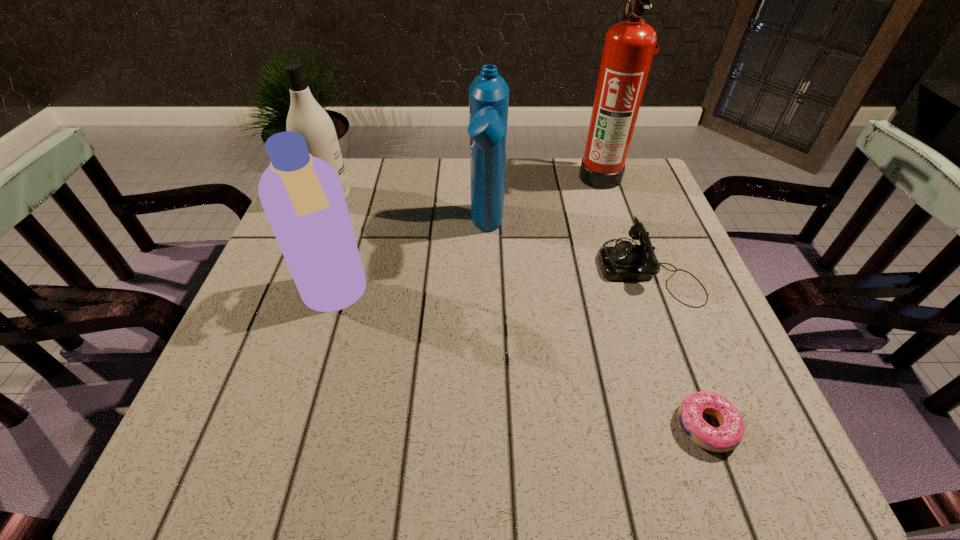
Locate an element on the screen. This screenshot has height=540, width=960. vacant region that satisfies the following two spatial constraints: 1. on the front-facing side of the telephone; 2. on the front side of the nearest shampoo is located at coordinates (659, 297).

Where is `vacant space that satisfies the following two spatial constraints: 1. on the front side of the nearest shampoo; 2. on the right side of the nearest object`? The width and height of the screenshot is (960, 540). vacant space that satisfies the following two spatial constraints: 1. on the front side of the nearest shampoo; 2. on the right side of the nearest object is located at coordinates (295, 426).

This screenshot has height=540, width=960. I want to click on vacant space that satisfies the following two spatial constraints: 1. on the front-facing side of the telephone; 2. on the front side of the doughnut, so click(707, 426).